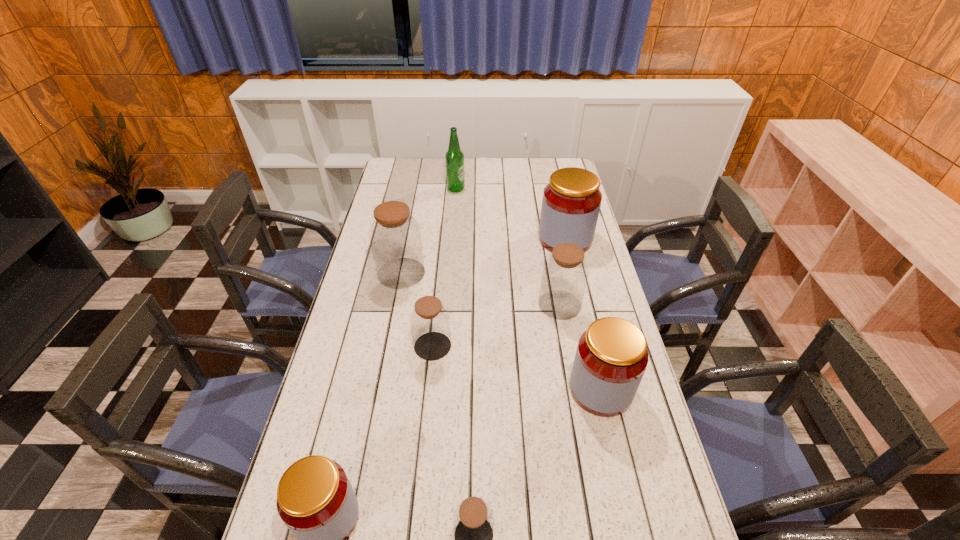
Locate an element on the screen. vacant space at the far left corner of the desktop is located at coordinates [x=384, y=174].

Where is `blank region between the farthest object and the biggest red jar`? The height and width of the screenshot is (540, 960). blank region between the farthest object and the biggest red jar is located at coordinates coord(511,214).

Locate an element on the screen. The height and width of the screenshot is (540, 960). empty space between the second nearest red jar and the biggest brown jar is located at coordinates (501, 331).

The height and width of the screenshot is (540, 960). I want to click on empty location between the third nearest object and the biggest brown jar, so click(x=501, y=331).

This screenshot has height=540, width=960. I want to click on object that can be found as the second closest to the biggest brown jar, so click(x=565, y=273).

Identify which object is the fifth nearest to the leftmost red jar. Please provide its 2D coordinates. Your answer should be formatted as a tuple, i.e. [(x, y)], where the tuple contains the x and y coordinates of a point satisfying the conditions above.

[(565, 273)]

Select which jar appears as the third closest to the farthest red jar. Please provide its 2D coordinates. Your answer should be formatted as a tuple, i.e. [(x, y)], where the tuple contains the x and y coordinates of a point satisfying the conditions above.

[(430, 324)]

Find the location of a particular element. jar that is the fifth closest one to the third brown jar from left to right is located at coordinates (395, 236).

Select which red jar is the closest to the farthest jar. Please provide its 2D coordinates. Your answer should be formatted as a tuple, i.e. [(x, y)], where the tuple contains the x and y coordinates of a point satisfying the conditions above.

[(611, 358)]

This screenshot has width=960, height=540. In order to click on red jar that can be found as the second closest to the second farthest red jar in this screenshot , I will do `click(315, 499)`.